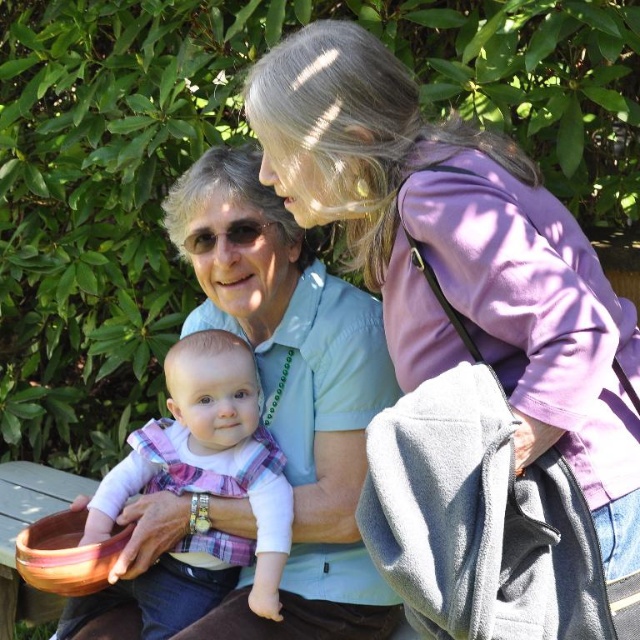
Is purple matte jacket at upper right in front of matte blue shirt at center?

Yes, it is.

Does purple matte jacket at upper right appear under matte blue shirt at center?

Incorrect, purple matte jacket at upper right is not positioned below matte blue shirt at center.

Image resolution: width=640 pixels, height=640 pixels. Find the location of `purple matte jacket at upper right`. purple matte jacket at upper right is located at coordinates (460, 257).

Find the location of a particular element. Image resolution: width=640 pixels, height=640 pixels. purple matte jacket at upper right is located at coordinates (460, 257).

Between purple matte jacket at upper right and plaid fabric baby at center, which one is positioned lower?

Positioned lower is plaid fabric baby at center.

Which is in front, point (282, 72) or point (168, 387)?

Positioned in front is point (282, 72).

Locate an element on the screen. The height and width of the screenshot is (640, 640). purple matte jacket at upper right is located at coordinates (460, 257).

Who is taller, matte blue shirt at center or plaid fabric baby at center?

matte blue shirt at center

Find the location of a particular element. Image resolution: width=640 pixels, height=640 pixels. matte blue shirt at center is located at coordinates (292, 392).

Where is `matte blue shirt at center`? The width and height of the screenshot is (640, 640). matte blue shirt at center is located at coordinates (292, 392).